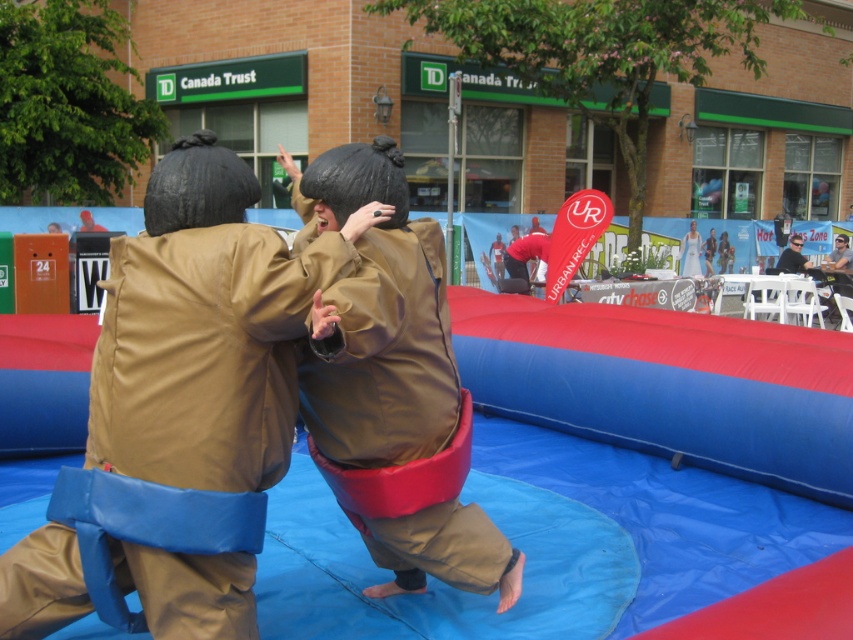
Which is more to the right, brown leather sumo at center or smooth black sunglasses at upper right?

From the viewer's perspective, smooth black sunglasses at upper right appears more on the right side.

Between brown leather sumo at center and smooth black sunglasses at upper right, which one has less height?

With less height is smooth black sunglasses at upper right.

Where is `brown leather sumo at center`? brown leather sumo at center is located at coordinates (206, 328).

Is brown matte sumo at center wider than smooth black sunglasses at upper right?

Yes.

Is brown matte sumo at center to the right of smooth black sunglasses at upper right from the viewer's perspective?

No, brown matte sumo at center is not to the right of smooth black sunglasses at upper right.

Which is in front, point (473, 547) or point (776, 266)?

Point (473, 547)

Where is `brown matte sumo at center`? brown matte sumo at center is located at coordinates (376, 321).

Is point (181, 220) more distant than point (335, 408)?

No, (181, 220) is in front of (335, 408).

Is point (132, 387) closer to viewer compared to point (384, 374)?

Yes, it is in front of point (384, 374).

What are the coordinates of `brown leather sumo at center` in the screenshot? It's located at (206, 328).

Image resolution: width=853 pixels, height=640 pixels. I want to click on brown leather sumo at center, so click(x=206, y=328).